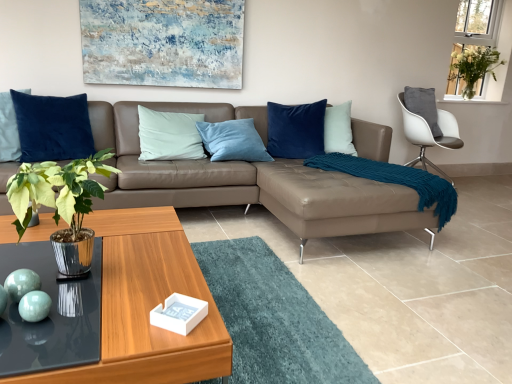
Question: Could you tell me if teal glossy spheres at lower left, marked as the 2th teal in a right-to-left arrangement, is turned towards transparent glass table at lower left?

Choices:
 (A) yes
 (B) no

Answer: (B)

Question: Can you confirm if teal glossy spheres at lower left, marked as the 2th teal in a right-to-left arrangement, is bigger than transparent glass table at lower left?

Choices:
 (A) no
 (B) yes

Answer: (A)

Question: From the image's perspective, does teal glossy spheres at lower left, marked as the 2th teal in a right-to-left arrangement, appear higher than transparent glass table at lower left?

Choices:
 (A) no
 (B) yes

Answer: (B)

Question: Is teal glossy spheres at lower left, the first teal in the left-to-right sequence, to the left of transparent glass table at lower left from the viewer's perspective?

Choices:
 (A) no
 (B) yes

Answer: (B)

Question: From the image's perspective, is teal glossy spheres at lower left, marked as the 2th teal in a right-to-left arrangement, beneath transparent glass table at lower left?

Choices:
 (A) no
 (B) yes

Answer: (A)

Question: Would you say teal knitted blanket at right is inside or outside wooden glossy coffee table at lower left?

Choices:
 (A) inside
 (B) outside

Answer: (B)

Question: Is point (352, 168) positioned closer to the camera than point (139, 344)?

Choices:
 (A) farther
 (B) closer

Answer: (A)

Question: Would you say teal knitted blanket at right is to the left or to the right of wooden glossy coffee table at lower left in the picture?

Choices:
 (A) right
 (B) left

Answer: (A)

Question: Relative to wooden glossy coffee table at lower left, is teal knitted blanket at right in front or behind?

Choices:
 (A) front
 (B) behind

Answer: (B)

Question: Is point (462, 38) closer or farther from the camera than point (77, 281)?

Choices:
 (A) closer
 (B) farther

Answer: (B)

Question: Would you say white glass vase at upper right is to the left or to the right of transparent glass table at lower left in the picture?

Choices:
 (A) left
 (B) right

Answer: (B)

Question: From the image's perspective, is white glass vase at upper right positioned above or below transparent glass table at lower left?

Choices:
 (A) above
 (B) below

Answer: (A)

Question: Is white glass vase at upper right spatially inside transparent glass table at lower left, or outside of it?

Choices:
 (A) outside
 (B) inside

Answer: (A)

Question: Based on their positions, is shiny metallic plant at center-left located to the left or right of white fabric chair at upper right?

Choices:
 (A) right
 (B) left

Answer: (B)

Question: Considering the positions of shiny metallic plant at center-left and white fabric chair at upper right in the image, is shiny metallic plant at center-left wider or thinner than white fabric chair at upper right?

Choices:
 (A) thin
 (B) wide

Answer: (A)